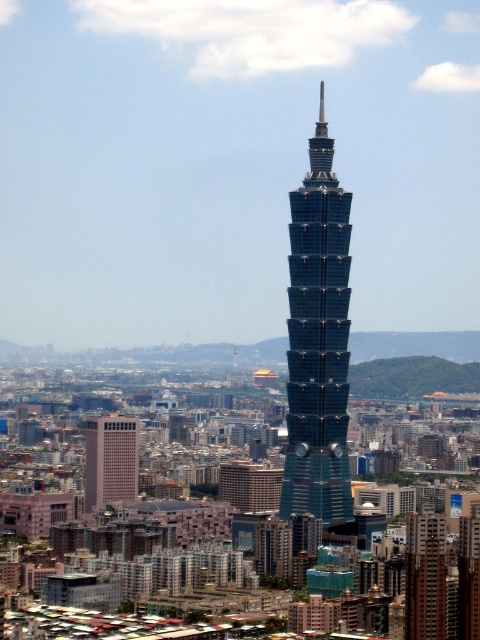
Based on the photo, does shiny glass skyscraper at center appear on the left side of beige brick building at lower left?

In fact, shiny glass skyscraper at center is to the right of beige brick building at lower left.

Who is positioned more to the right, shiny glass skyscraper at center or beige brick building at lower left?

From the viewer's perspective, shiny glass skyscraper at center appears more on the right side.

Is point (322, 324) closer to camera compared to point (123, 477)?

Yes, it is in front of point (123, 477).

Where is `shiny glass skyscraper at center`? This screenshot has height=640, width=480. shiny glass skyscraper at center is located at coordinates (317, 340).

Is shiny glass skyscraper at center thinner than green glass skyscraper at center?

In fact, shiny glass skyscraper at center might be wider than green glass skyscraper at center.

Is shiny glass skyscraper at center above green glass skyscraper at center?

Indeed, shiny glass skyscraper at center is positioned over green glass skyscraper at center.

In order to click on shiny glass skyscraper at center in this screenshot , I will do `click(317, 340)`.

Who is lower down, green glass skyscraper at center or beige brick building at lower left?

Positioned lower is green glass skyscraper at center.

Is green glass skyscraper at center shorter than beige brick building at lower left?

In fact, green glass skyscraper at center may be taller than beige brick building at lower left.

Locate an element on the screen. The width and height of the screenshot is (480, 640). green glass skyscraper at center is located at coordinates (424, 577).